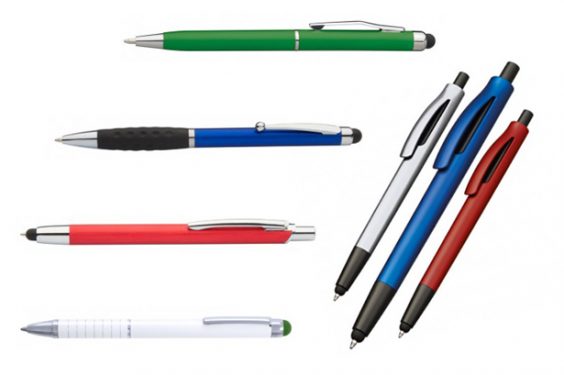
Find the location of a particular element. This screenshot has height=375, width=564. pens is located at coordinates (287, 43), (263, 139), (223, 232), (226, 325), (376, 211), (411, 238), (438, 252).